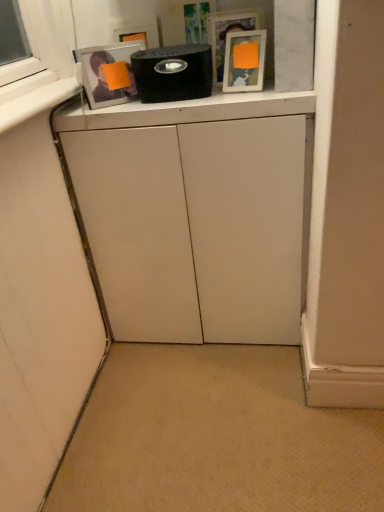
Question: Can you see black matte speaker at upper center touching matte white picture frame at upper center?

Choices:
 (A) no
 (B) yes

Answer: (A)

Question: Would you say matte white picture frame at upper center is part of black matte speaker at upper center's contents?

Choices:
 (A) no
 (B) yes

Answer: (A)

Question: From the image's perspective, is black matte speaker at upper center over matte white picture frame at upper center?

Choices:
 (A) yes
 (B) no

Answer: (B)

Question: Can you confirm if black matte speaker at upper center is bigger than matte white picture frame at upper center?

Choices:
 (A) no
 (B) yes

Answer: (B)

Question: From the image's perspective, is black matte speaker at upper center below matte white picture frame at upper center?

Choices:
 (A) yes
 (B) no

Answer: (A)

Question: In the image, is matte white picture frame at upper center positioned in front of or behind white matte cabinet at center?

Choices:
 (A) behind
 (B) front

Answer: (A)

Question: Considering the positions of matte white picture frame at upper center and white matte cabinet at center in the image, is matte white picture frame at upper center wider or thinner than white matte cabinet at center?

Choices:
 (A) wide
 (B) thin

Answer: (B)

Question: Considering the positions of point (263, 36) and point (175, 126), is point (263, 36) closer or farther from the camera than point (175, 126)?

Choices:
 (A) closer
 (B) farther

Answer: (B)

Question: Considering the relative positions of matte white picture frame at upper center and white matte cabinet at center in the image provided, is matte white picture frame at upper center to the left or to the right of white matte cabinet at center?

Choices:
 (A) left
 (B) right

Answer: (B)

Question: Looking at their shapes, would you say white matte cabinet at center is wider or thinner than matte white picture frame at upper center?

Choices:
 (A) thin
 (B) wide

Answer: (B)

Question: Is point (92, 189) closer or farther from the camera than point (223, 61)?

Choices:
 (A) closer
 (B) farther

Answer: (B)

Question: Visually, is white matte cabinet at center positioned to the left or to the right of matte white picture frame at upper center?

Choices:
 (A) left
 (B) right

Answer: (A)

Question: From their relative heights in the image, would you say white matte cabinet at center is taller or shorter than matte white picture frame at upper center?

Choices:
 (A) tall
 (B) short

Answer: (A)

Question: Considering the positions of matte white picture frame at upper center and black matte speaker at upper center in the image, is matte white picture frame at upper center taller or shorter than black matte speaker at upper center?

Choices:
 (A) short
 (B) tall

Answer: (B)

Question: In terms of width, does matte white picture frame at upper center look wider or thinner when compared to black matte speaker at upper center?

Choices:
 (A) thin
 (B) wide

Answer: (A)